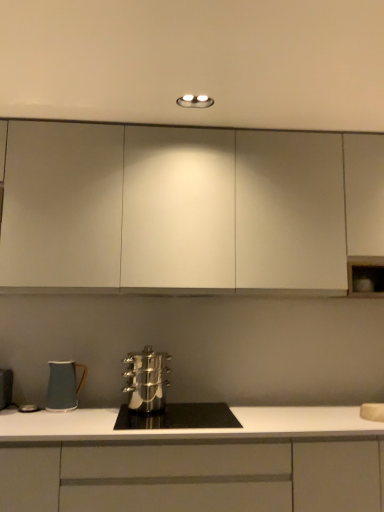
Question: Considering the relative positions of stainless steel cookware at center and white matte cabinet at center, the second cabinetry viewed from the top, in the image provided, is stainless steel cookware at center behind white matte cabinet at center, the second cabinetry viewed from the top,?

Choices:
 (A) yes
 (B) no

Answer: (A)

Question: Considering the relative sizes of stainless steel cookware at center and white matte cabinet at center, which is the first cabinetry in bottom-to-top order, in the image provided, is stainless steel cookware at center shorter than white matte cabinet at center, which is the first cabinetry in bottom-to-top order,?

Choices:
 (A) yes
 (B) no

Answer: (A)

Question: From the image's perspective, is stainless steel cookware at center located above white matte cabinet at center, which is the first cabinetry in bottom-to-top order?

Choices:
 (A) yes
 (B) no

Answer: (A)

Question: Considering the relative positions of stainless steel cookware at center and white matte cabinet at center, which is the first cabinetry in bottom-to-top order, in the image provided, is stainless steel cookware at center in front of white matte cabinet at center, which is the first cabinetry in bottom-to-top order,?

Choices:
 (A) no
 (B) yes

Answer: (A)

Question: Is stainless steel cookware at center oriented towards white matte cabinet at center, the second cabinetry viewed from the top?

Choices:
 (A) no
 (B) yes

Answer: (B)

Question: Is point (74, 389) positioned closer to the camera than point (59, 137)?

Choices:
 (A) closer
 (B) farther

Answer: (A)

Question: From the image's perspective, is matte ceramic mug at lower left, marked as the first kitchen appliance in a left-to-right arrangement, located above or below white matte cabinet at upper center, the first cabinetry in the top-to-bottom sequence?

Choices:
 (A) above
 (B) below

Answer: (B)

Question: Relative to white matte cabinet at upper center, the first cabinetry in the top-to-bottom sequence, is matte ceramic mug at lower left, marked as the first kitchen appliance in a left-to-right arrangement, in front or behind?

Choices:
 (A) front
 (B) behind

Answer: (B)

Question: Is matte ceramic mug at lower left, marked as the first kitchen appliance in a left-to-right arrangement, spatially inside white matte cabinet at upper center, the second cabinetry in the bottom-to-top sequence, or outside of it?

Choices:
 (A) outside
 (B) inside

Answer: (A)

Question: From a real-world perspective, is white matte cabinet at upper center, the first cabinetry in the top-to-bottom sequence, physically located above or below white matte sink at lower right?

Choices:
 (A) above
 (B) below

Answer: (A)

Question: Considering the relative positions of white matte cabinet at upper center, the first cabinetry in the top-to-bottom sequence, and white matte sink at lower right in the image provided, is white matte cabinet at upper center, the first cabinetry in the top-to-bottom sequence, to the left or to the right of white matte sink at lower right?

Choices:
 (A) left
 (B) right

Answer: (A)

Question: In terms of height, does white matte cabinet at upper center, the first cabinetry in the top-to-bottom sequence, look taller or shorter compared to white matte sink at lower right?

Choices:
 (A) short
 (B) tall

Answer: (B)

Question: Does point (218, 222) appear closer or farther from the camera than point (380, 412)?

Choices:
 (A) farther
 (B) closer

Answer: (A)

Question: Is white matte cabinet at upper center, the first cabinetry in the top-to-bottom sequence, taller or shorter than matte ceramic mug at lower left, marked as the first kitchen appliance in a left-to-right arrangement?

Choices:
 (A) short
 (B) tall

Answer: (B)

Question: Considering the positions of white matte cabinet at upper center, the first cabinetry in the top-to-bottom sequence, and matte ceramic mug at lower left, marked as the first kitchen appliance in a left-to-right arrangement, in the image, is white matte cabinet at upper center, the first cabinetry in the top-to-bottom sequence, bigger or smaller than matte ceramic mug at lower left, marked as the first kitchen appliance in a left-to-right arrangement,?

Choices:
 (A) big
 (B) small

Answer: (A)